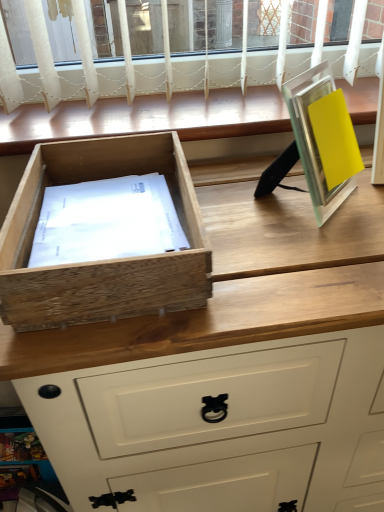
This screenshot has height=512, width=384. What are the coordinates of `vacant area on top of natural wood chest of drawers at center (from a real-world perspective)` in the screenshot? It's located at (272, 212).